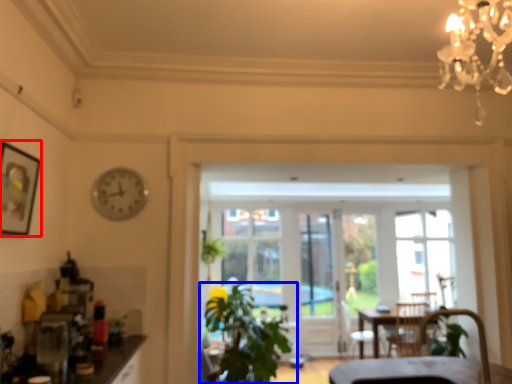
Question: Which of the following is the closest to the observer, picture frame (highlighted by a red box) or houseplant (highlighted by a blue box)?

Choices:
 (A) picture frame
 (B) houseplant

Answer: (A)